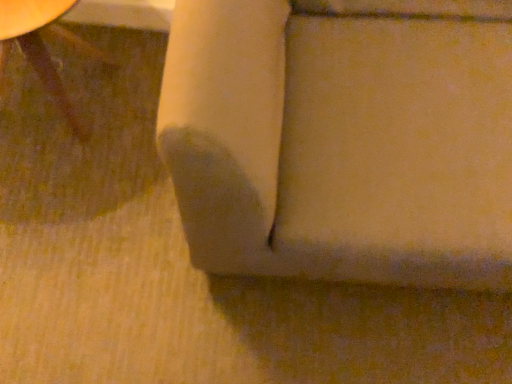
Question: Relative to matte brown wood table at lower left, placed as the second furniture when sorted from right to left, is matte beige cushion at center, the second furniture in the left-to-right sequence, in front or behind?

Choices:
 (A) front
 (B) behind

Answer: (A)

Question: Do you think matte beige cushion at center, the second furniture in the left-to-right sequence, is within matte brown wood table at lower left, placed as the 1th furniture when sorted from left to right, or outside of it?

Choices:
 (A) inside
 (B) outside

Answer: (B)

Question: From the image's perspective, is matte beige cushion at center, positioned as the first furniture in right-to-left order, located above or below matte brown wood table at lower left, placed as the 1th furniture when sorted from left to right?

Choices:
 (A) above
 (B) below

Answer: (B)

Question: From a real-world perspective, is matte brown wood table at lower left, placed as the second furniture when sorted from right to left, positioned above or below matte beige cushion at center, positioned as the first furniture in right-to-left order?

Choices:
 (A) above
 (B) below

Answer: (B)

Question: Does point (54, 16) appear closer or farther from the camera than point (446, 4)?

Choices:
 (A) farther
 (B) closer

Answer: (B)

Question: Is matte brown wood table at lower left, placed as the second furniture when sorted from right to left, in front of or behind matte beige cushion at center, the second furniture in the left-to-right sequence, in the image?

Choices:
 (A) behind
 (B) front

Answer: (A)

Question: Is matte brown wood table at lower left, placed as the 1th furniture when sorted from left to right, bigger or smaller than matte beige cushion at center, positioned as the first furniture in right-to-left order?

Choices:
 (A) small
 (B) big

Answer: (A)